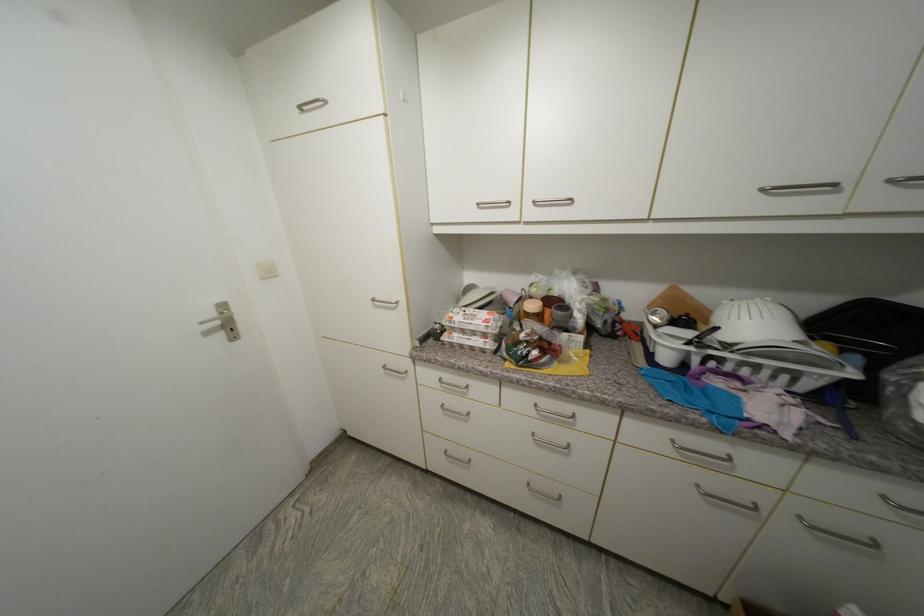
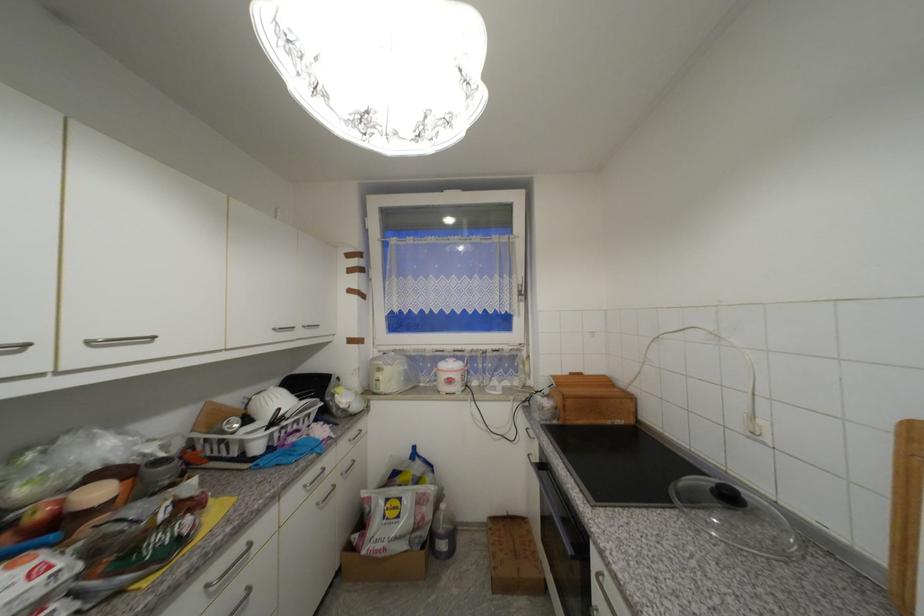
Where in the second image is the point corresponding to [885,471] from the first image?

(354, 430)